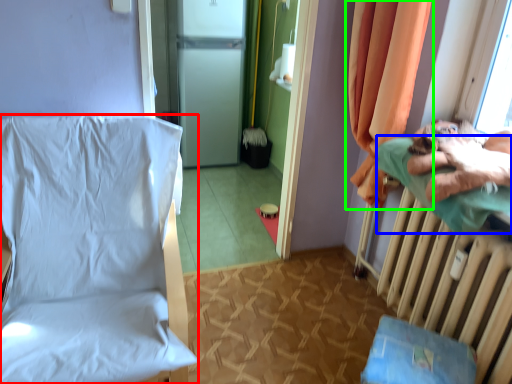
Question: Estimate the real-world distances between objects in this image. Which object is farther from furniture (highlighted by a red box), pillow (highlighted by a blue box) or curtain (highlighted by a green box)?

Choices:
 (A) pillow
 (B) curtain

Answer: (A)